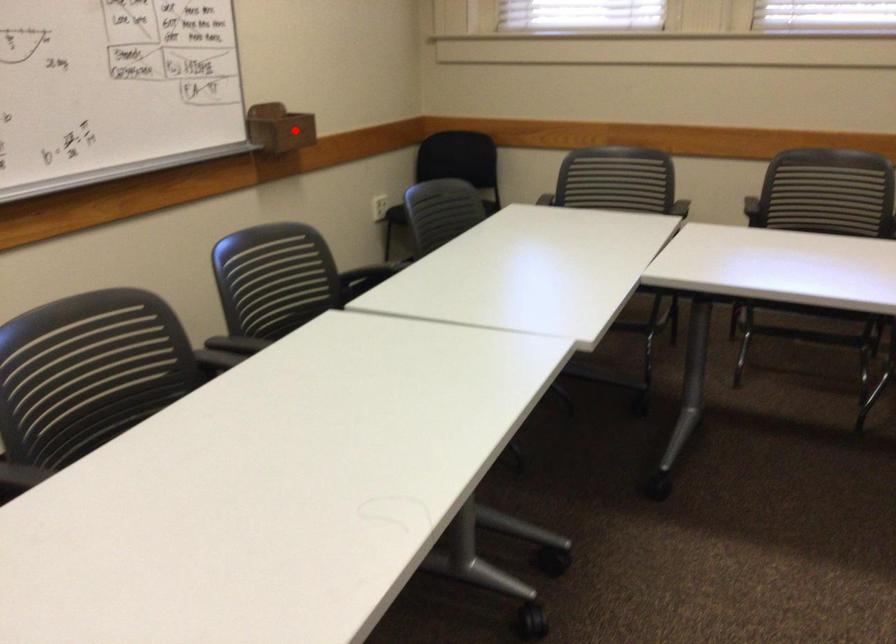
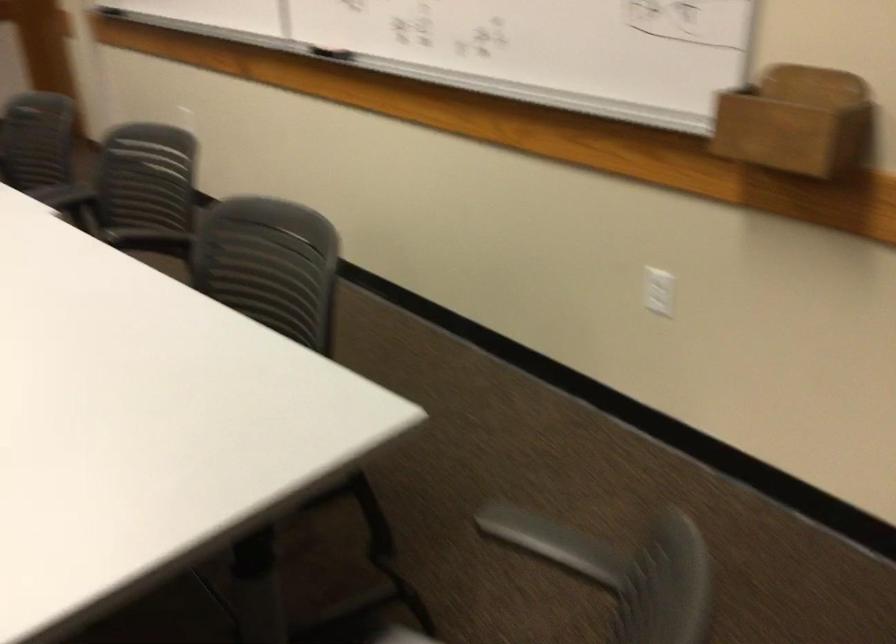
In the second image, find the point that corresponds to the highlighted location in the first image.

(797, 122)